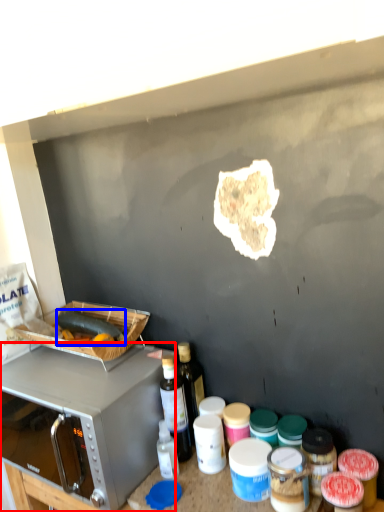
Question: Among these objects, which one is farthest to the camera, microwave oven (highlighted by a red box) or food (highlighted by a blue box)?

Choices:
 (A) microwave oven
 (B) food

Answer: (B)